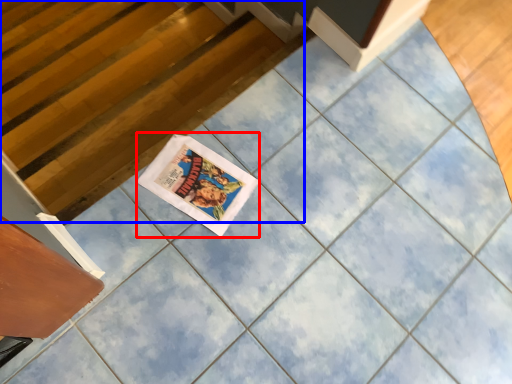
Question: Which object appears farthest to the camera in this image, comic book (highlighted by a red box) or stairwell (highlighted by a blue box)?

Choices:
 (A) comic book
 (B) stairwell

Answer: (B)